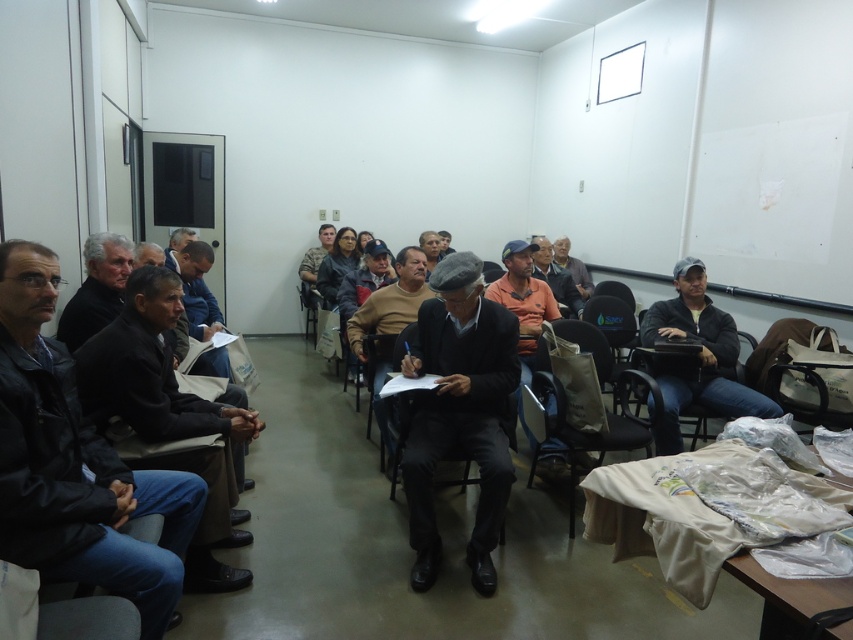
Is black leather jacket at left thinner than dark brown leather jacket at left?

Correct, black leather jacket at left's width is less than dark brown leather jacket at left's.

Is black leather jacket at left smaller than dark brown leather jacket at left?

Yes.

What do you see at coordinates (76, 465) in the screenshot? I see `black leather jacket at left` at bounding box center [76, 465].

In order to click on black leather jacket at left in this screenshot , I will do `click(76, 465)`.

Between dark gray woolen hat at center and black fabric chair at center, which one has more height?

Standing taller between the two is dark gray woolen hat at center.

Does dark gray woolen hat at center appear under black fabric chair at center?

Incorrect, dark gray woolen hat at center is not positioned below black fabric chair at center.

Between point (483, 416) and point (405, 416), which one is positioned behind?

The point (405, 416) is behind.

This screenshot has height=640, width=853. Identify the location of dark gray woolen hat at center. (460, 412).

Is black fabric chair at center to the right of orange fabric shirt at center from the viewer's perspective?

No, black fabric chair at center is not to the right of orange fabric shirt at center.

Can you confirm if black fabric chair at center is wider than orange fabric shirt at center?

Correct, the width of black fabric chair at center exceeds that of orange fabric shirt at center.

Is point (393, 428) behind point (558, 291)?

No, (393, 428) is in front of (558, 291).

Find the location of a particular element. The width and height of the screenshot is (853, 640). black fabric chair at center is located at coordinates (393, 432).